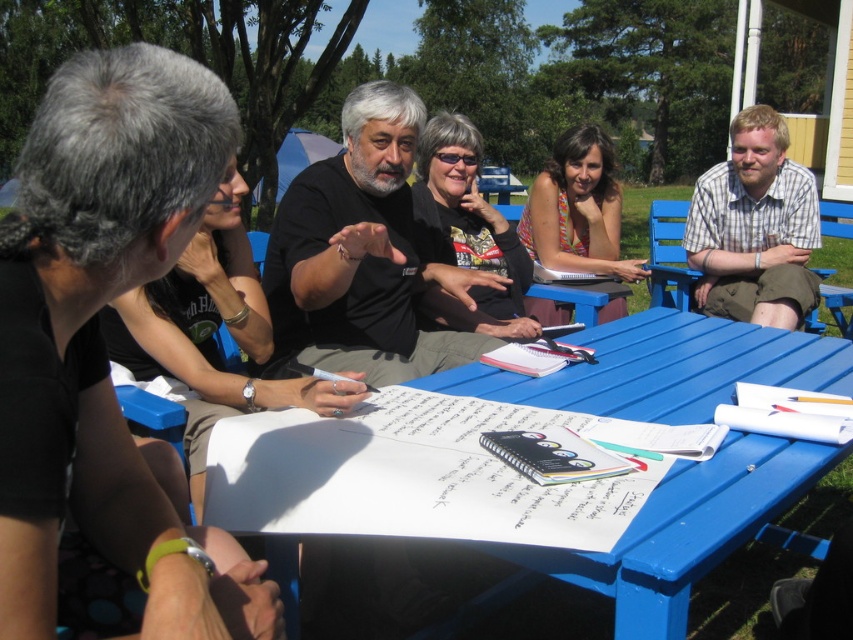
Which is more to the right, blue plastic table at center or black matte shirt at center?

From the viewer's perspective, blue plastic table at center appears more on the right side.

Is blue plastic table at center taller than black matte shirt at center?

No, blue plastic table at center is not taller than black matte shirt at center.

The image size is (853, 640). Describe the element at coordinates (547, 486) in the screenshot. I see `blue plastic table at center` at that location.

Where is `blue plastic table at center`? This screenshot has height=640, width=853. blue plastic table at center is located at coordinates (547, 486).

Is point (294, 218) less distant than point (721, 208)?

Yes, point (294, 218) is in front of point (721, 208).

Consider the image. Is black matte shirt at center shorter than plaid shirt at upper right?

Yes, black matte shirt at center is shorter than plaid shirt at upper right.

Is point (277, 248) less distant than point (759, 180)?

Yes, point (277, 248) is closer to viewer.

The height and width of the screenshot is (640, 853). Identify the location of black matte shirt at center. (361, 253).

Does black matte shirt at center have a greater width compared to blue wood park bench at right?

Incorrect, black matte shirt at center's width does not surpass blue wood park bench at right's.

Can you confirm if black matte shirt at center is thinner than blue wood park bench at right?

Indeed, black matte shirt at center has a lesser width compared to blue wood park bench at right.

Find the location of a particular element. The width and height of the screenshot is (853, 640). black matte shirt at center is located at coordinates (361, 253).

You are a GUI agent. You are given a task and a screenshot of the screen. Output one action in this format:
    pyautogui.click(x=<x>, y=<y>)
    Task: Click on the black matte shirt at center
    
    Given the screenshot: What is the action you would take?
    pyautogui.click(x=361, y=253)